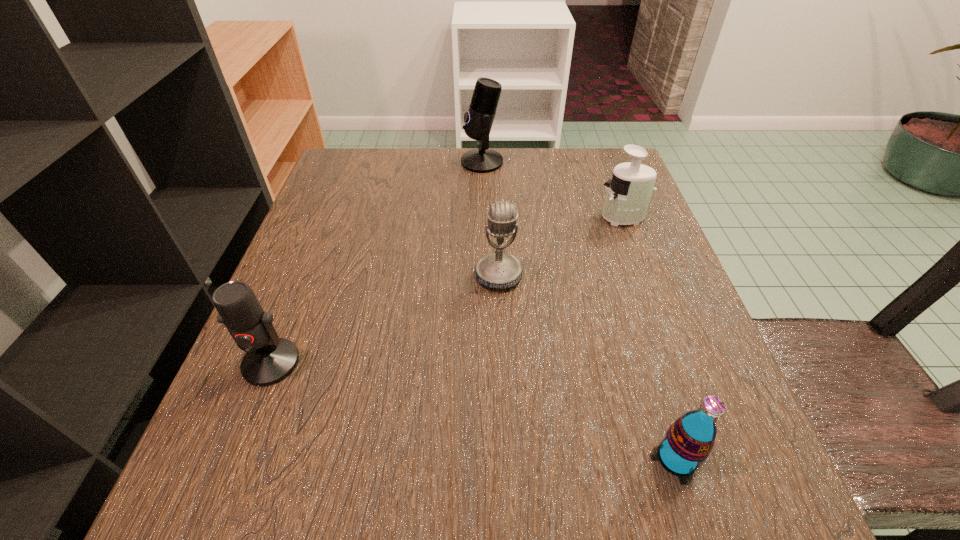
At what (x,y) coordinates should I click in order to perform the action: click on free space at the far edge of the desktop. Please return your answer as a coordinate pair (x, y). Looking at the image, I should click on (433, 187).

At what (x,y) coordinates should I click in order to perform the action: click on free spot at the left edge of the desktop. Please return your answer as a coordinate pair (x, y). The width and height of the screenshot is (960, 540). Looking at the image, I should click on (231, 393).

Identify the location of vacant area at the right edge. The width and height of the screenshot is (960, 540). (622, 298).

Locate an element on the screen. vacant space at the far left corner of the desktop is located at coordinates (373, 179).

Identify the location of vacant space at the far right corner of the desktop. The width and height of the screenshot is (960, 540). (617, 150).

The width and height of the screenshot is (960, 540). I want to click on free point at the near right corner, so click(765, 471).

Identify the location of free space between the third nearest object and the juicer. The height and width of the screenshot is (540, 960). (561, 246).

The width and height of the screenshot is (960, 540). What are the coordinates of `free space that is in between the second nearest microphone and the juicer` in the screenshot? It's located at (561, 246).

Identify the location of empty space that is in between the second nearest microphone and the fourth farthest object. The width and height of the screenshot is (960, 540). (x=385, y=319).

In order to click on free space between the leftmost microphone and the second farthest microphone in this screenshot , I will do `click(385, 319)`.